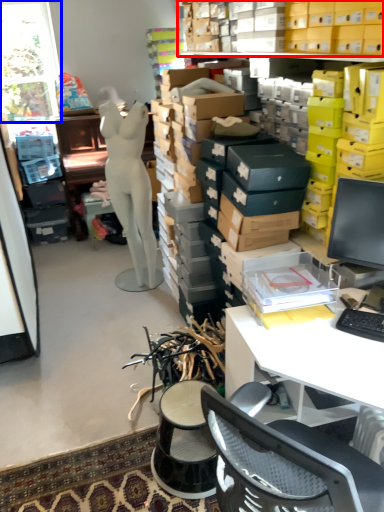
Question: Which point is further to the camera, shelf (highlighted by a red box) or window (highlighted by a blue box)?

Choices:
 (A) shelf
 (B) window

Answer: (B)